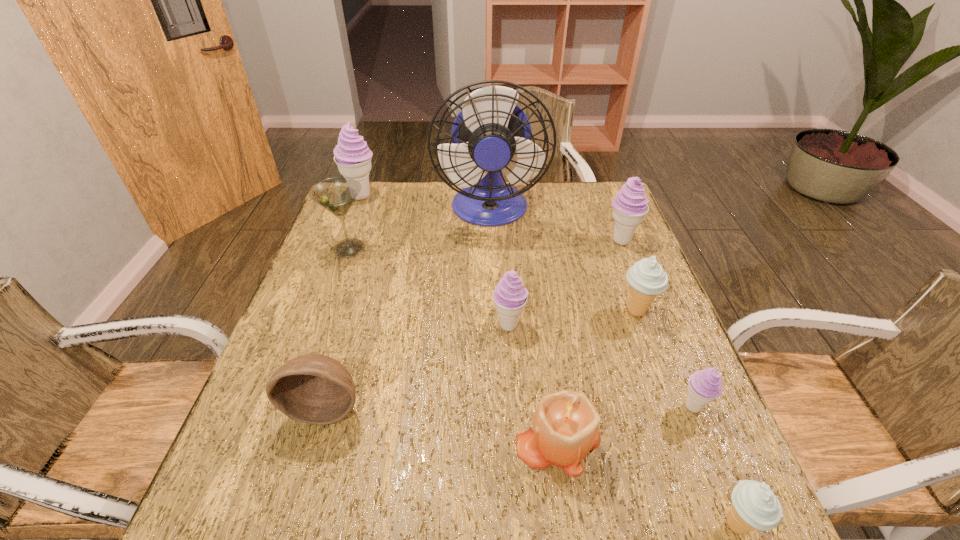
You are a GUI agent. You are given a task and a screenshot of the screen. Output one action in this format:
    pyautogui.click(x=<x>, y=<y>)
    Task: Click on the vacant space located 0.270m on the back of the candle
    The image size is (960, 540).
    Given the screenshot: What is the action you would take?
    pyautogui.click(x=540, y=310)

Where is `vacant space located on the back of the nearest purple icecream`? vacant space located on the back of the nearest purple icecream is located at coordinates (652, 305).

The height and width of the screenshot is (540, 960). I want to click on fan located at the far edge, so click(x=491, y=135).

Identify the location of icecream that is at the far edge. The height and width of the screenshot is (540, 960). (353, 157).

At what (x,y) coordinates should I click in order to perform the action: click on icecream positioned at the left edge. Please return your answer as a coordinate pair (x, y). The width and height of the screenshot is (960, 540). Looking at the image, I should click on (353, 157).

Locate an element on the screen. This screenshot has height=540, width=960. martini that is at the left edge is located at coordinates (337, 194).

I want to click on bowl located at the left edge, so click(313, 388).

Locate an element on the screen. The image size is (960, 540). object situated at the far left corner is located at coordinates (353, 157).

Where is `vacant space at the far edge`? The height and width of the screenshot is (540, 960). vacant space at the far edge is located at coordinates (564, 201).

In the image, there is a desktop. Where is `free space at the near edge`? free space at the near edge is located at coordinates (484, 532).